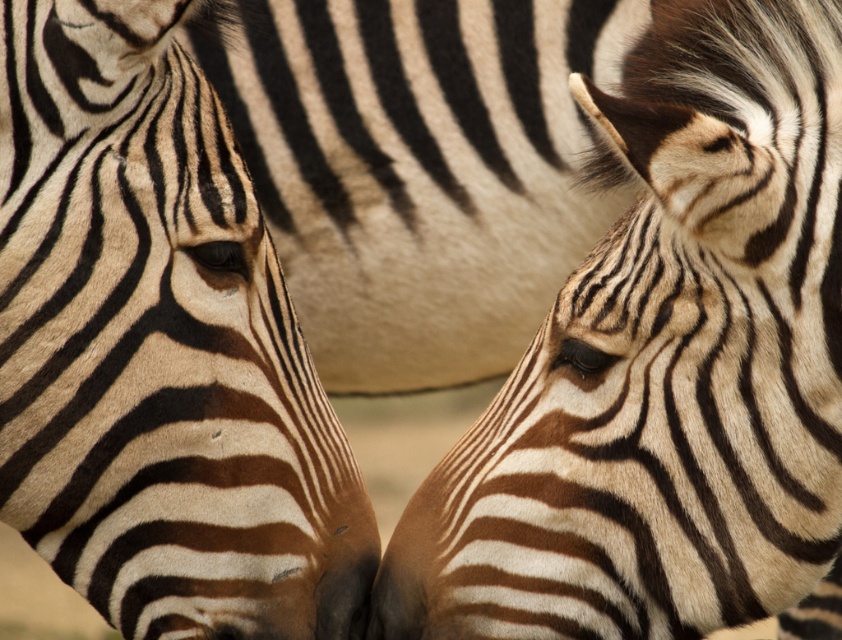
You are a wildlife photographer trying to capture a clear shot of both the black and white striped zebra head at right and the black matte nose at center. Based on their positions, which one is closer to the camera?

The black and white striped zebra head at right is in front of the black matte nose at center, so it is closer to the camera.

You are a wildlife photographer trying to capture the black and white striped zebra at center and the black matte nose at center in your shot. Since you want to emphasize the zebra, should you use a wider or narrower lens to ensure the zebra takes up more space in the photo?

The black and white striped zebra at center is wider than the black matte nose at center, so using a wider lens would help emphasize the zebra by capturing more of its larger width in the photo.

You are a wildlife photographer aiming to capture a closeup of the black and white striped zebra at center and the black matte nose at center. Which one should you focus on if you want to photograph the larger subject?

The black and white striped zebra at center is much taller than the black matte nose at center, so you should focus on the black and white striped zebra at center to photograph the larger subject.